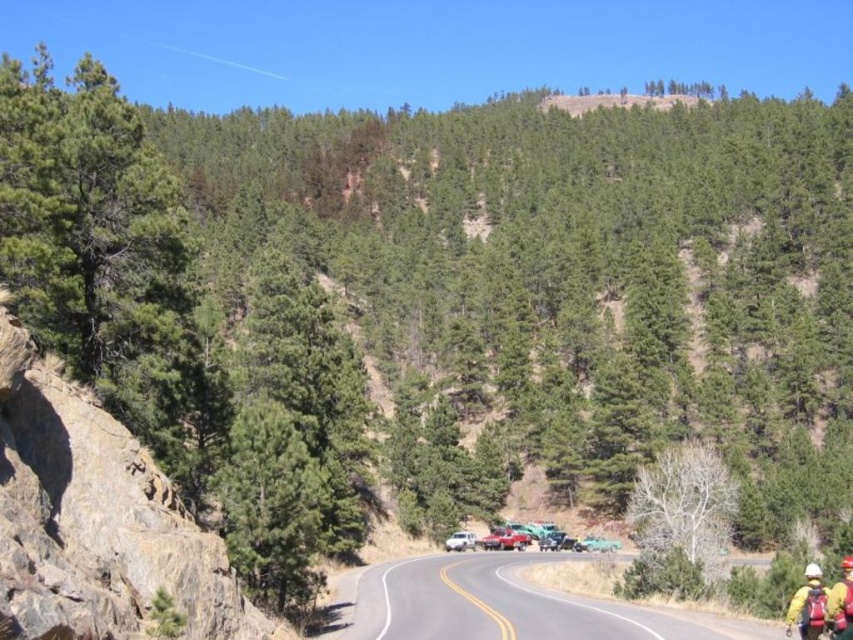
You are standing at the point marked as point (x=511, y=605) on the image. Which direction should you walk to reach the smooth asphalt road at center?

You should walk towards the center because point (x=511, y=605) indicates smooth asphalt road at center.

You are a hiker standing at the starting point of the road. You see the smooth asphalt road at center and the yellow fabric helmet at lower right. Which object is closer to you?

The yellow fabric helmet at lower right is closer to you because it is positioned above the smooth asphalt road at center, which is further away.

You are a hiker who has just finished a long trek and wants to place your yellow fabric helmet at lower right on the smooth asphalt road at center. Considering the distance between them, can you estimate whether you can throw your helmet from your current position to the road?

The distance between the smooth asphalt road at center and the yellow fabric helmet at lower right is 62.18 feet. Since this distance is quite large, it would be challenging to throw the helmet that far. You might need to walk closer to place it on the road.